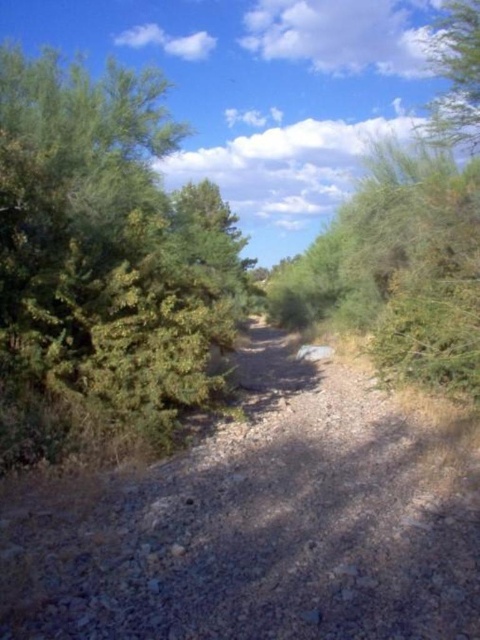
Question: Is green leafy bush at left to the left of green leafy bush at upper right from the viewer's perspective?

Choices:
 (A) yes
 (B) no

Answer: (A)

Question: Can you confirm if dusty gravel path at center is positioned below green leafy bush at upper right?

Choices:
 (A) no
 (B) yes

Answer: (B)

Question: Which point is closer to the camera?

Choices:
 (A) green leafy bush at upper right
 (B) dusty gravel path at center

Answer: (B)

Question: Can you confirm if green leafy bush at left is smaller than green leafy bush at upper right?

Choices:
 (A) no
 (B) yes

Answer: (B)

Question: Which object is positioned farthest from the dusty gravel path at center?

Choices:
 (A) green leafy bush at upper right
 (B) green leafy bush at left

Answer: (A)

Question: Which point is farther to the camera?

Choices:
 (A) green leafy bush at left
 (B) green leafy bush at upper right
 (C) dusty gravel path at center

Answer: (B)